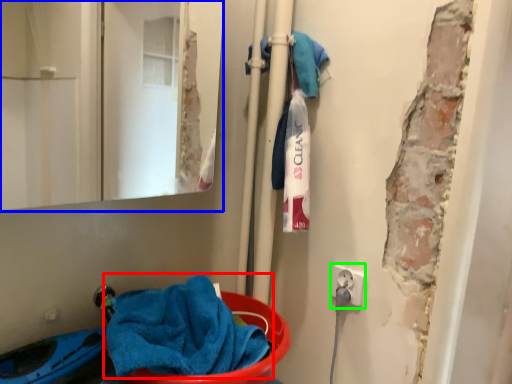
Question: Which object is positioned closest to towel (highlighted by a red box)? Select from mirror (highlighted by a blue box) and electric outlet (highlighted by a green box).

Choices:
 (A) mirror
 (B) electric outlet

Answer: (B)